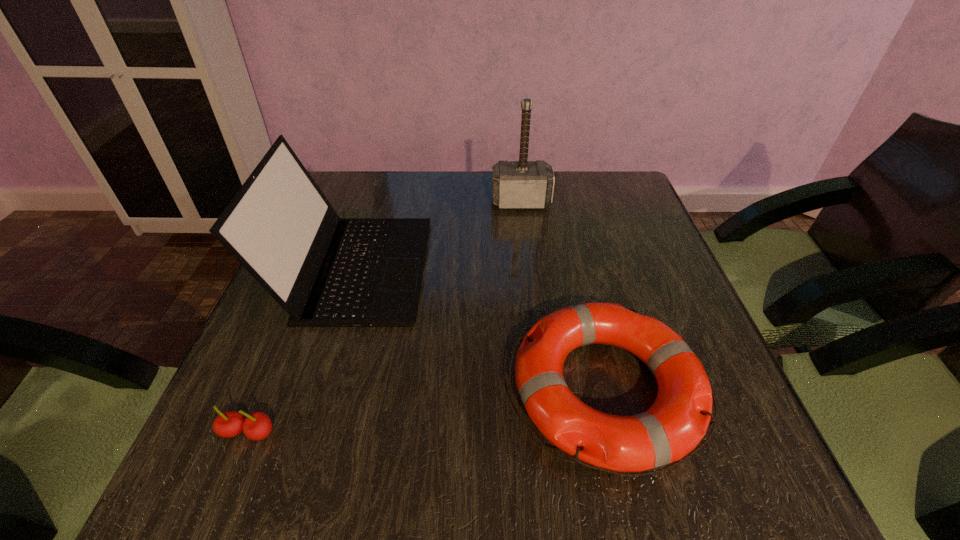
Choose which object is the third nearest neighbor to the hammer. Please provide its 2D coordinates. Your answer should be formatted as a tuple, i.e. [(x, y)], where the tuple contains the x and y coordinates of a point satisfying the conditions above.

[(256, 426)]

Image resolution: width=960 pixels, height=540 pixels. I want to click on object that stands as the third closest to the third shortest object, so click(256, 426).

The image size is (960, 540). I want to click on vacant area that satisfies the following two spatial constraints: 1. on the surface of the life buoy; 2. on the right side of the laptop, so [x=318, y=390].

Locate an element on the screen. free point that satisfies the following two spatial constraints: 1. on the surface of the life buoy; 2. on the right side of the laptop is located at coordinates (318, 390).

The image size is (960, 540). What are the coordinates of `vacant area that satisfies the following two spatial constraints: 1. for striking with the head of the hammer; 2. on the left side of the life buoy` in the screenshot? It's located at (543, 390).

At what (x,y) coordinates should I click in order to perform the action: click on vacant space that satisfies the following two spatial constraints: 1. for striking with the head of the farthest object; 2. on the surface of the laptop. Please return your answer as a coordinate pair (x, y). The image size is (960, 540). Looking at the image, I should click on (529, 268).

Locate an element on the screen. blank area in the image that satisfies the following two spatial constraints: 1. for striking with the head of the farthest object; 2. on the surface of the third shortest object is located at coordinates click(x=529, y=268).

The width and height of the screenshot is (960, 540). In order to click on free location that satisfies the following two spatial constraints: 1. for striking with the head of the farthest object; 2. on the surface of the laptop in this screenshot , I will do `click(529, 268)`.

Identify the location of vacant area in the image that satisfies the following two spatial constraints: 1. for striking with the head of the life buoy; 2. on the right side of the farthest object. (543, 390).

Locate an element on the screen. This screenshot has height=540, width=960. vacant space that satisfies the following two spatial constraints: 1. on the surface of the second tallest object; 2. on the front side of the cherry is located at coordinates point(304,433).